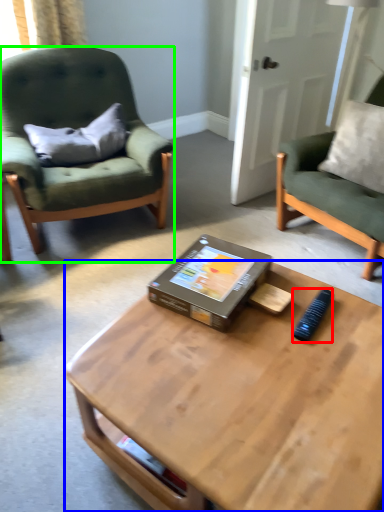
Question: Estimate the real-world distances between objects in this image. Which object is farther from remote control (highlighted by a red box), coffee table (highlighted by a blue box) or chair (highlighted by a green box)?

Choices:
 (A) coffee table
 (B) chair

Answer: (B)